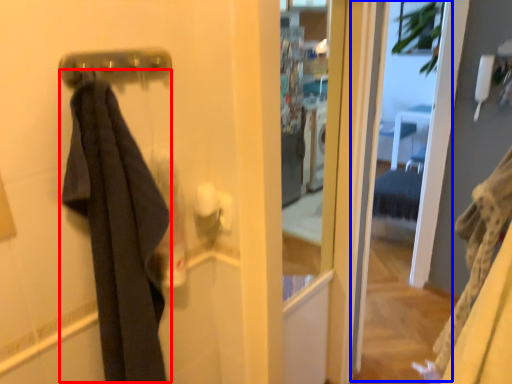
Question: Among these objects, which one is farthest to the camera, clothing (highlighted by a red box) or screen door (highlighted by a blue box)?

Choices:
 (A) clothing
 (B) screen door

Answer: (B)